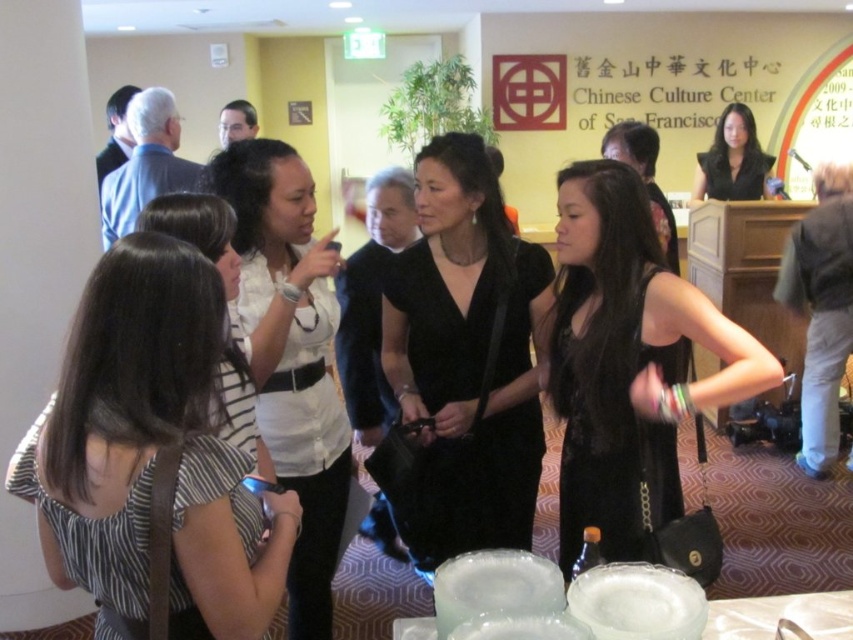
Question: Which point is closer to the camera?

Choices:
 (A) black leather handbag at center
 (B) black lace dress at center
 (C) black velvet dress at center
 (D) striped fabric dress at center

Answer: (D)

Question: In this image, where is white matte shirt at center located relative to clear plastic plates at center?

Choices:
 (A) above
 (B) below

Answer: (A)

Question: Which point is farther from the camera taking this photo?

Choices:
 (A) (735, 132)
 (B) (412, 221)
 (C) (321, 276)

Answer: (A)

Question: Which of the following is the farthest from the observer?

Choices:
 (A) black silk dress at upper right
 (B) white matte shirt at center
 (C) striped fabric blouse at center
 (D) clear plastic plates at center

Answer: (A)

Question: Can you confirm if clear plastic plates at center is positioned above black silk dress at upper right?

Choices:
 (A) yes
 (B) no

Answer: (B)

Question: Is black lace dress at center bigger than striped fabric blouse at center?

Choices:
 (A) no
 (B) yes

Answer: (B)